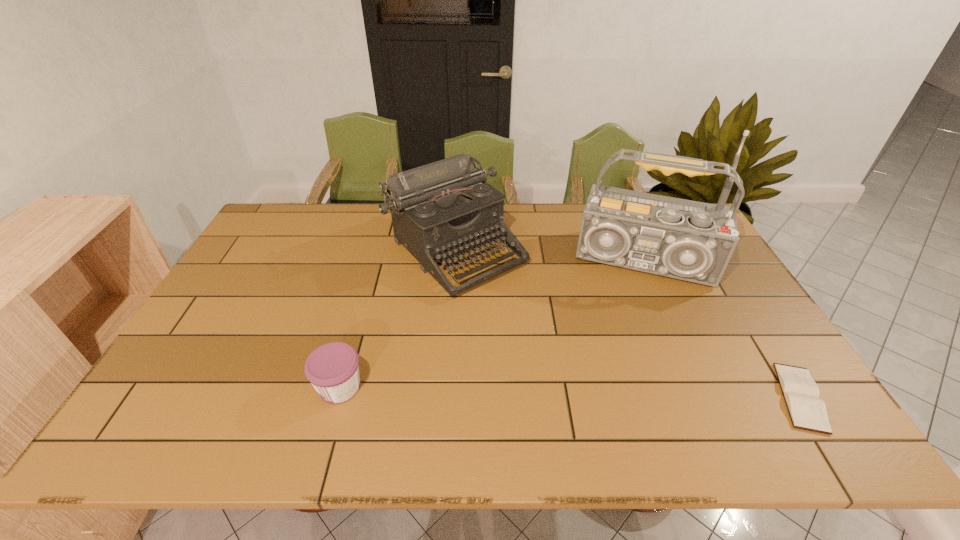
The height and width of the screenshot is (540, 960). I want to click on vacant spot on the desktop that is between the jam and the shortest object and is positioned on the typing side of the typewriter, so click(x=611, y=393).

The height and width of the screenshot is (540, 960). Identify the location of vacant space on the desktop that is between the second shortest object and the diary and is positioned on the front-facing side of the radio receiver. (631, 394).